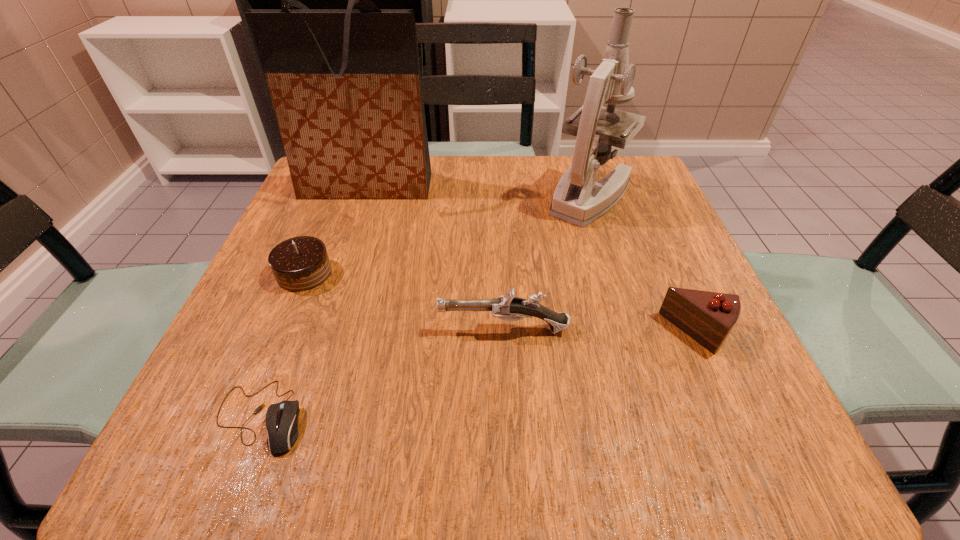
Where is `vacant space situated 0.280m aimed along the barrel of the fourth object from left to right`? vacant space situated 0.280m aimed along the barrel of the fourth object from left to right is located at coordinates coord(269,329).

Find the location of a particular element. free space located 0.120m aimed along the barrel of the fourth object from left to right is located at coordinates (367, 329).

Find the location of a particular element. This screenshot has height=540, width=960. free spot located aimed along the barrel of the fourth object from left to right is located at coordinates (348, 329).

Find the location of a particular element. This screenshot has height=540, width=960. vacant space positioned on the back of the third farthest object is located at coordinates (340, 187).

You are a GUI agent. You are given a task and a screenshot of the screen. Output one action in this format:
    pyautogui.click(x=<x>, y=<y>)
    Task: Click on the vacant space located on the left of the right chocolate cake
    This screenshot has width=960, height=540.
    Given the screenshot: What is the action you would take?
    pyautogui.click(x=537, y=332)

The height and width of the screenshot is (540, 960). I want to click on vacant space located 0.080m on the back of the computer mouse, so pyautogui.click(x=291, y=338).

This screenshot has width=960, height=540. Identify the location of shopping bag that is at the far edge. (346, 87).

Identify the location of microscope at the far edge. The image size is (960, 540). (578, 199).

This screenshot has width=960, height=540. I want to click on object located at the near edge, so click(x=281, y=419).

At what (x,y) coordinates should I click in order to perform the action: click on shopping bag that is at the left edge. Please return your answer as a coordinate pair (x, y). This screenshot has height=540, width=960. Looking at the image, I should click on (346, 87).